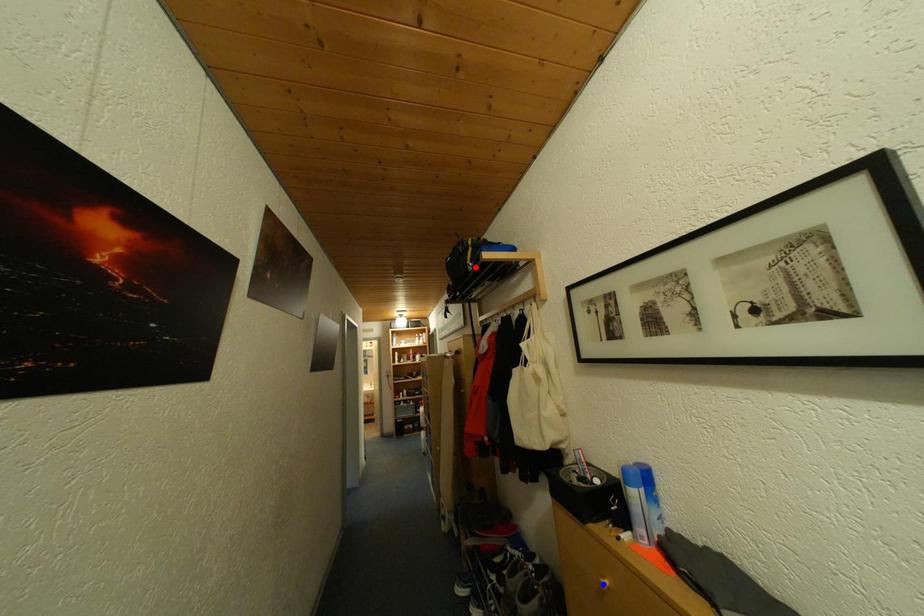
Question: Which of the two points in the image is closer to the camera?

Choices:
 (A) Blue point is closer.
 (B) Red point is closer.

Answer: (A)